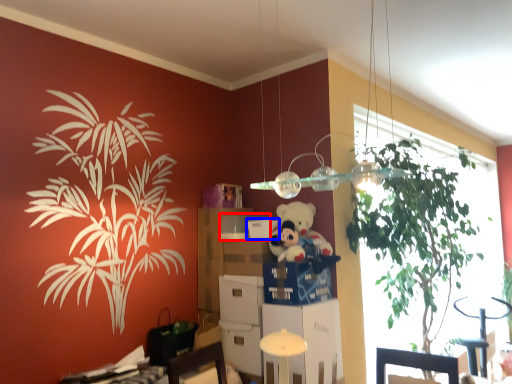
Question: Which object is closer to the camera taking this photo, box (highlighted by a red box) or box (highlighted by a blue box)?

Choices:
 (A) box
 (B) box

Answer: (B)